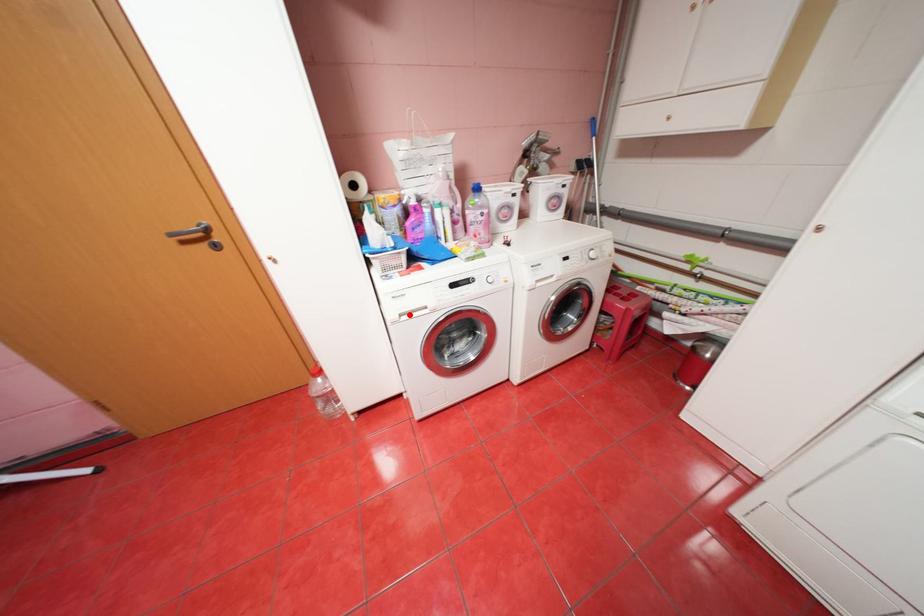
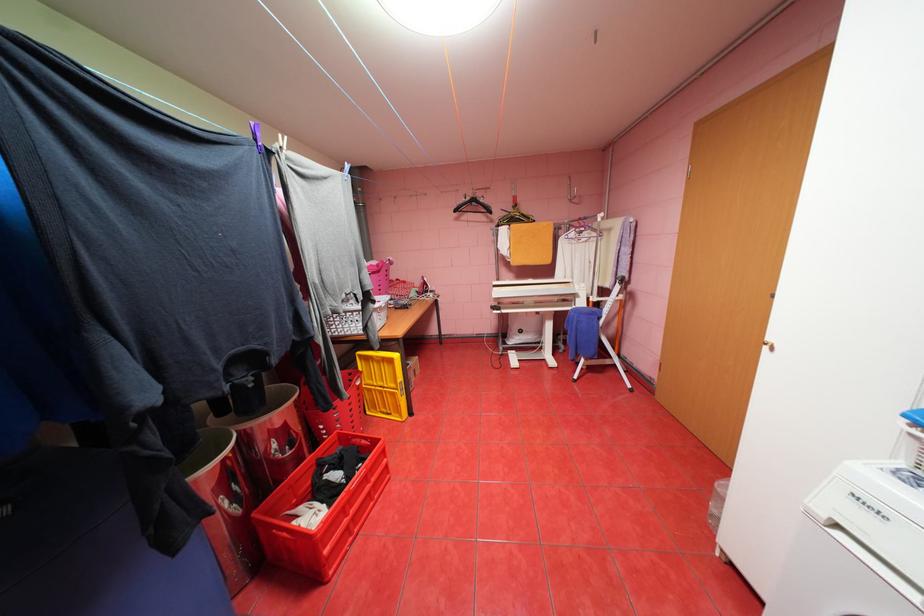
Locate, in the second image, the point that corresponds to the highlighted location in the first image.

(845, 525)